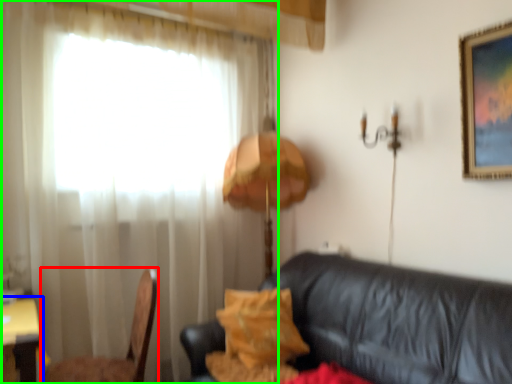
Question: Which object is the farthest from chair (highlighted by a red box)? Choose among these: table (highlighted by a blue box) or curtain (highlighted by a green box).

Choices:
 (A) table
 (B) curtain

Answer: (B)